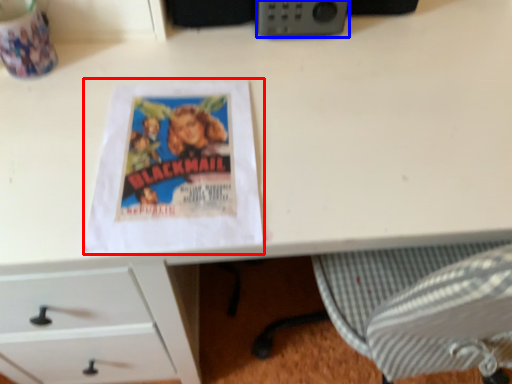
Question: Which object is further to the camera taking this photo, paperback book (highlighted by a red box) or gadget (highlighted by a blue box)?

Choices:
 (A) paperback book
 (B) gadget

Answer: (B)